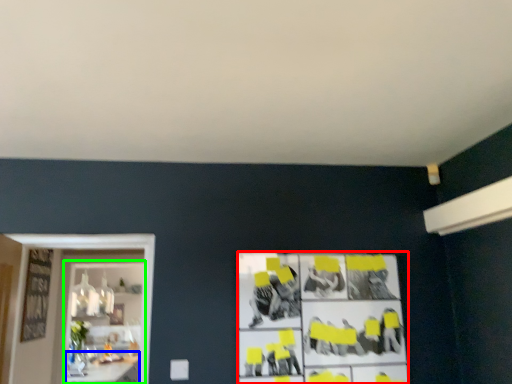
Question: Which object is positioned farthest from poster (highlighted by a red box)? Select from table (highlighted by a blue box) and shelf (highlighted by a green box).

Choices:
 (A) table
 (B) shelf

Answer: (B)